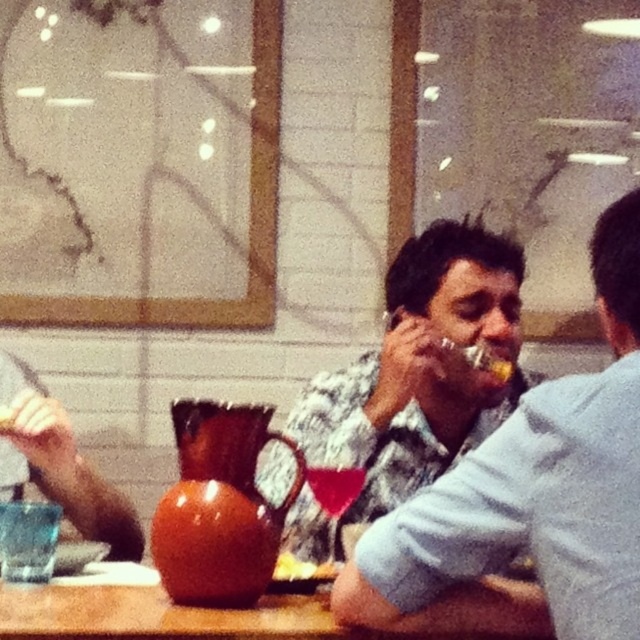
Can you confirm if floral-patterned shirt at center is shorter than translucent glass at center?

No, floral-patterned shirt at center is not shorter than translucent glass at center.

Is point (332, 518) positioned before point (355, 497)?

No.

Which is behind, point (417, 259) or point (356, 477)?

Point (417, 259)

This screenshot has height=640, width=640. Identify the location of floral-patterned shirt at center. (413, 380).

Which of these two, translucent glass at center or matte orange glass at center, stands shorter?

Standing shorter between the two is matte orange glass at center.

Can you confirm if translucent glass at center is thinner than matte orange glass at center?

In fact, translucent glass at center might be wider than matte orange glass at center.

Locate an element on the screen. This screenshot has width=640, height=640. translucent glass at center is located at coordinates (333, 486).

Is wooden table at center thinner than matte orange glass at center?

No, wooden table at center is not thinner than matte orange glass at center.

Can you confirm if wooden table at center is positioned above matte orange glass at center?

No.

I want to click on wooden table at center, so click(x=176, y=616).